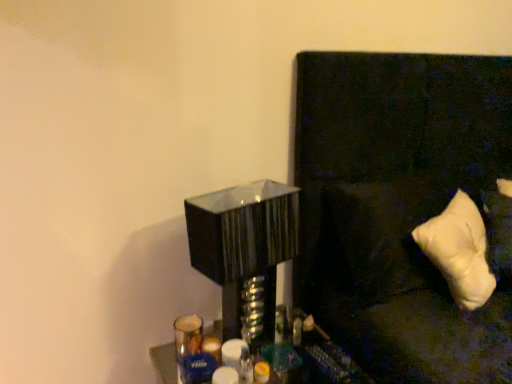
The width and height of the screenshot is (512, 384). Describe the element at coordinates (330, 360) in the screenshot. I see `metallic silver tray at lower center` at that location.

What are the coordinates of `glossy black table lamp at center` in the screenshot? It's located at (248, 256).

The width and height of the screenshot is (512, 384). In order to click on white soft pillow at right in this screenshot , I will do [x=401, y=207].

In order to face white soft pillow at right, should I rotate leftwards or rightwards?

You should rotate right by 25.725 degrees.

The height and width of the screenshot is (384, 512). Describe the element at coordinates (459, 251) in the screenshot. I see `white soft pillow at right` at that location.

Locate an element on the screen. This screenshot has height=384, width=512. metallic silver tray at lower center is located at coordinates (330, 360).

Does metallic silver tray at lower center have a smaller size compared to white soft pillow at right?

Correct, metallic silver tray at lower center occupies less space than white soft pillow at right.

Which object is positioned more to the left, metallic silver tray at lower center or white soft pillow at right?

metallic silver tray at lower center.

Image resolution: width=512 pixels, height=384 pixels. Find the location of `couch on the right of metallic silver tray at lower center`. couch on the right of metallic silver tray at lower center is located at coordinates (401, 207).

Is white soft pillow at right completely or partially inside metallic silver tray at lower center?

Definitely not — white soft pillow at right is not inside metallic silver tray at lower center.

From a real-world perspective, is white soft pillow at right physically below glossy black table lamp at center?

No.

Looking at their sizes, would you say white soft pillow at right is wider or thinner than glossy black table lamp at center?

white soft pillow at right is wider than glossy black table lamp at center.

Which is less distant, (415, 304) or (224, 193)?

Point (224, 193)

Which point is more forward, (192, 202) or (301, 312)?

The point (192, 202) is closer.

Is glossy black table lamp at center far away from metallic silver tray at lower center?

No, glossy black table lamp at center is not far away from metallic silver tray at lower center.

Consider the image. Is glossy black table lamp at center completely or partially outside of metallic silver tray at lower center?

Yes, glossy black table lamp at center is not within metallic silver tray at lower center.

At what (x,y) coordinates should I click in order to perform the action: click on couch on the left of white soft pillow at right. Please return your answer as a coordinate pair (x, y). Looking at the image, I should click on pyautogui.click(x=401, y=207).

Between white soft pillow at right and white soft pillow at right, which one has smaller size?

Smaller between the two is white soft pillow at right.

Relative to white soft pillow at right, is white soft pillow at right in front or behind?

Visually, white soft pillow at right is located behind white soft pillow at right.

From the image's perspective, is white soft pillow at right above or below white soft pillow at right?

white soft pillow at right is below white soft pillow at right.

From a real-world perspective, is glossy black table lamp at center above or below white soft pillow at right?

glossy black table lamp at center is situated lower than white soft pillow at right in the real world.

Is glossy black table lamp at center wider than white soft pillow at right?

Incorrect, the width of glossy black table lamp at center does not surpass that of white soft pillow at right.

Could you tell me if glossy black table lamp at center is turned towards white soft pillow at right?

No.

Considering the sizes of glossy black table lamp at center and white soft pillow at right in the image, is glossy black table lamp at center taller or shorter than white soft pillow at right?

Clearly, glossy black table lamp at center is taller compared to white soft pillow at right.

How far apart are white soft pillow at right and glossy black table lamp at center?

white soft pillow at right and glossy black table lamp at center are 19.95 inches apart from each other.

From a real-world perspective, is white soft pillow at right on glossy black table lamp at center?

Yes, from a real-world perspective, white soft pillow at right is over glossy black table lamp at center

Could you tell me if white soft pillow at right is turned towards glossy black table lamp at center?

No, white soft pillow at right is not oriented towards glossy black table lamp at center.

Is point (456, 284) closer or farther from the camera than point (234, 187)?

Point (456, 284) is positioned closer to the camera compared to point (234, 187).

Would you say metallic silver tray at lower center is inside or outside glossy black table lamp at center?

metallic silver tray at lower center is located beyond the bounds of glossy black table lamp at center.

At what (x,y) coordinates should I click in order to perform the action: click on furniture below the glossy black table lamp at center (from the image's perspective). Please return your answer as a coordinate pair (x, y). The height and width of the screenshot is (384, 512). Looking at the image, I should click on (330, 360).

Is point (152, 358) closer to camera compared to point (192, 228)?

No, (152, 358) is further to viewer.

Where is `furniture below the white soft pillow at right (from the image's perspective)`? furniture below the white soft pillow at right (from the image's perspective) is located at coordinates (330, 360).

The image size is (512, 384). In order to click on couch above the glossy black table lamp at center (from a real-world perspective) in this screenshot , I will do `click(401, 207)`.

From the image, which object appears to be farther from white soft pillow at right, glossy black table lamp at center or white soft pillow at right?

glossy black table lamp at center is positioned further to the anchor white soft pillow at right.

Based on their spatial positions, is white soft pillow at right or glossy black table lamp at center further from metallic silver tray at lower center?

The object further to metallic silver tray at lower center is white soft pillow at right.

Based on their spatial positions, is glossy black table lamp at center or metallic silver tray at lower center further from white soft pillow at right?

glossy black table lamp at center lies further to white soft pillow at right than the other object.

Considering their positions, is white soft pillow at right positioned further to white soft pillow at right than metallic silver tray at lower center?

metallic silver tray at lower center is further to white soft pillow at right.

Looking at the image, which one is located closer to white soft pillow at right, white soft pillow at right or metallic silver tray at lower center?

white soft pillow at right is closer to white soft pillow at right.

Estimate the real-world distances between objects in this image. Which object is closer to white soft pillow at right, glossy black table lamp at center or white soft pillow at right?

white soft pillow at right lies closer to white soft pillow at right than the other object.

Looking at the image, which one is located further to white soft pillow at right, glossy black table lamp at center or metallic silver tray at lower center?

metallic silver tray at lower center.

Based on their spatial positions, is white soft pillow at right or white soft pillow at right further from metallic silver tray at lower center?

white soft pillow at right is further to metallic silver tray at lower center.

Image resolution: width=512 pixels, height=384 pixels. In order to click on furniture between glossy black table lamp at center and white soft pillow at right from left to right in this screenshot , I will do `click(330, 360)`.

You are a GUI agent. You are given a task and a screenshot of the screen. Output one action in this format:
    pyautogui.click(x=<x>, y=<y>)
    Task: Click on the couch between glossy black table lamp at center and white soft pillow at right from left to right
    
    Given the screenshot: What is the action you would take?
    pyautogui.click(x=401, y=207)

This screenshot has height=384, width=512. I want to click on furniture between glossy black table lamp at center and white soft pillow at right, so click(x=330, y=360).

Locate an element on the screen. The width and height of the screenshot is (512, 384). couch situated between metallic silver tray at lower center and white soft pillow at right from left to right is located at coordinates (401, 207).